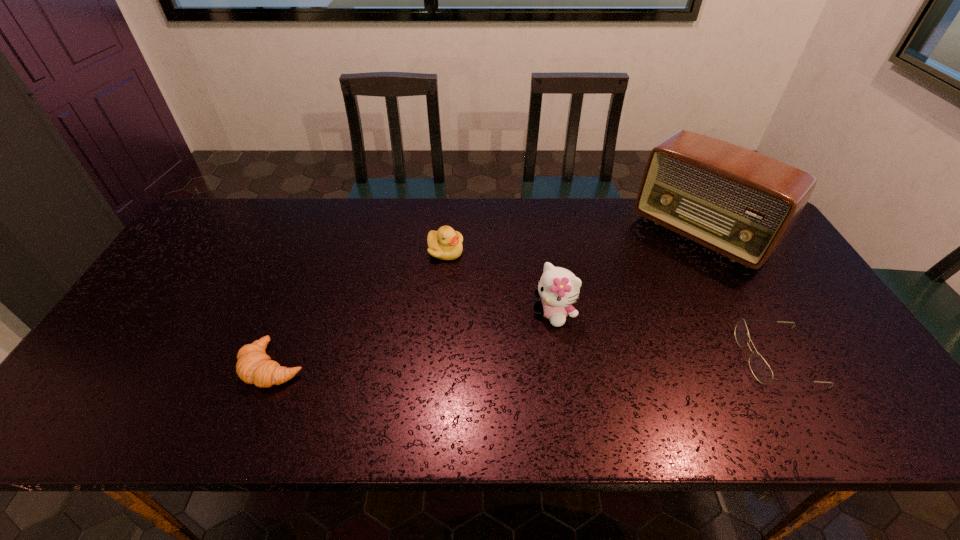
Locate an element on the screen. crescent roll is located at coordinates (254, 366).

The width and height of the screenshot is (960, 540). I want to click on spectacles, so click(x=760, y=369).

Where is `the third object from right to left`? This screenshot has width=960, height=540. the third object from right to left is located at coordinates (558, 287).

The image size is (960, 540). I want to click on the second tallest object, so click(558, 287).

Where is `the third tallest object`? Image resolution: width=960 pixels, height=540 pixels. the third tallest object is located at coordinates (446, 244).

Where is `duckling`? duckling is located at coordinates (446, 244).

Where is `radio receiver`? This screenshot has width=960, height=540. radio receiver is located at coordinates (739, 203).

Locate an element on the screen. Image resolution: width=960 pixels, height=540 pixels. vacant space located 0.130m on the back of the crescent roll is located at coordinates (299, 302).

Identify the location of vacant space located on the front-facing side of the spectacles. This screenshot has width=960, height=540. (685, 357).

You are a GUI agent. You are given a task and a screenshot of the screen. Output one action in this format:
    pyautogui.click(x=<x>, y=<y>)
    Task: Click on the free space located 0.050m on the front-facing side of the spectacles
    Image resolution: width=960 pixels, height=540 pixels.
    Given the screenshot: What is the action you would take?
    pyautogui.click(x=722, y=357)